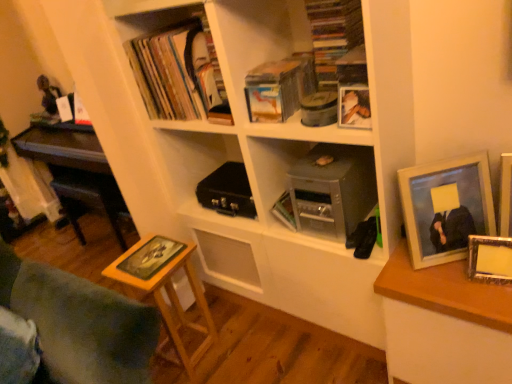
Image resolution: width=512 pixels, height=384 pixels. Describe the element at coordinates (446, 208) in the screenshot. I see `wooden picture frame at right, which is counted as the 3th picture frame, starting from the right` at that location.

What is the approximate height of metallic silver book at center, the second book when ordered from bottom to top?

The height of metallic silver book at center, the second book when ordered from bottom to top, is 5.14 inches.

Describe the element at coordinates (80, 324) in the screenshot. I see `wooden stool at lower left` at that location.

Identify the location of wooden stool at lower left. Image resolution: width=512 pixels, height=384 pixels. (80, 324).

This screenshot has height=384, width=512. Describe the element at coordinates (179, 73) in the screenshot. I see `matte black book at upper left, arranged as the second book when viewed from the left` at that location.

How much space does matte silver picture frame at right, positioned as the 1th picture frame in right-to-left order, occupy vertically?

The height of matte silver picture frame at right, positioned as the 1th picture frame in right-to-left order, is 12.48 inches.

At what (x,y) coordinates should I click in order to perform the action: click on wooden picture frame at right, which is counted as the 3th picture frame, starting from the right. Please return your answer as a coordinate pair (x, y). The height and width of the screenshot is (384, 512). Looking at the image, I should click on (446, 208).

Is black matte briefcase at center next to metallic silver book at center, the second book when ordered from bottom to top, and touching it?

No, black matte briefcase at center is not touching metallic silver book at center, the second book when ordered from bottom to top.

Looking at this image, is black matte briefcase at center oriented away from metallic silver book at center, which appears as the 1th book when viewed from the right?

No, metallic silver book at center, which appears as the 1th book when viewed from the right, is not at the back of black matte briefcase at center.

Which object is wider, black matte briefcase at center or metallic silver book at center, which is the third book from left to right?

black matte briefcase at center is wider.

Based on the photo, from the image's perspective, between black matte briefcase at center and metallic silver book at center, which appears as the 1th book when viewed from the right, who is located below?

metallic silver book at center, which appears as the 1th book when viewed from the right, is shown below in the image.

Is wooden photo frame at right, which ranks as the third picture frame in left-to-right order, directly adjacent to wooden table at lower left?

No, wooden photo frame at right, which ranks as the third picture frame in left-to-right order, is not next to wooden table at lower left.

Could you tell me if wooden photo frame at right, which ranks as the third picture frame in left-to-right order, is turned towards wooden table at lower left?

No, wooden photo frame at right, which ranks as the third picture frame in left-to-right order, does not turn towards wooden table at lower left.

Can you confirm if wooden photo frame at right, positioned as the second picture frame in right-to-left order, is smaller than wooden table at lower left?

Yes, wooden photo frame at right, positioned as the second picture frame in right-to-left order, is smaller than wooden table at lower left.

Measure the distance from metallic silver book at center, which is counted as the second book, starting from the top, to matte silver picture frame at right, the fourth picture frame viewed from the left.

They are 69.86 centimeters apart.

Is the depth of metallic silver book at center, which appears as the 1th book when viewed from the right, greater than that of matte silver picture frame at right, positioned as the 1th picture frame in right-to-left order?

Yes, the depth of metallic silver book at center, which appears as the 1th book when viewed from the right, is greater than that of matte silver picture frame at right, positioned as the 1th picture frame in right-to-left order.

Can you tell me how much metallic silver book at center, which is the third book from left to right, and matte silver picture frame at right, positioned as the 1th picture frame in right-to-left order, differ in facing direction?

15.6 degrees.

Are metallic silver book at center, which is the third book from left to right, and matte silver picture frame at right, the fourth picture frame viewed from the left, far apart?

That's not correct — metallic silver book at center, which is the third book from left to right, is a little close to matte silver picture frame at right, the fourth picture frame viewed from the left.

Is point (338, 118) positioned after point (290, 207)?

No, (338, 118) is closer to viewer.

Is matte silver photo frame at upper right, which is the 4th picture frame from right to left, next to metallic silver book at center, which is counted as the second book, starting from the top?

No, matte silver photo frame at upper right, which is the 4th picture frame from right to left, is not in contact with metallic silver book at center, which is counted as the second book, starting from the top.

From the image's perspective, starting from the metallic silver book at center, which is counted as the second book, starting from the top, which picture frame is the 3rd one above? Please provide its 2D coordinates.

[(354, 107)]

Considering the positions of objects matte silver photo frame at upper right, which is the 4th picture frame from right to left, and metallic silver book at center, which is counted as the second book, starting from the top, in the image provided, who is more to the right, matte silver photo frame at upper right, which is the 4th picture frame from right to left, or metallic silver book at center, which is counted as the second book, starting from the top,?

matte silver photo frame at upper right, which is the 4th picture frame from right to left, is more to the right.

Could wooden photo frame at right, positioned as the second picture frame in right-to-left order, be considered to be inside yellow matte board game at lower left, placed as the first book when sorted from bottom to top?

No.

Does yellow matte board game at lower left, placed as the third book when sorted from right to left, turn towards wooden photo frame at right, which ranks as the third picture frame in left-to-right order?

Yes, yellow matte board game at lower left, placed as the third book when sorted from right to left, is aimed at wooden photo frame at right, which ranks as the third picture frame in left-to-right order.

From the image's perspective, is yellow matte board game at lower left, placed as the first book when sorted from left to right, above wooden photo frame at right, positioned as the second picture frame in right-to-left order?

Incorrect, from the image's perspective, yellow matte board game at lower left, placed as the first book when sorted from left to right, is lower than wooden photo frame at right, positioned as the second picture frame in right-to-left order.

In terms of width, does wooden stool at lower left look wider or thinner when compared to metallic gray briefcase at center?

wooden stool at lower left is wider than metallic gray briefcase at center.

Considering the relative positions of wooden stool at lower left and metallic gray briefcase at center in the image provided, is wooden stool at lower left to the left or to the right of metallic gray briefcase at center?

wooden stool at lower left is positioned on metallic gray briefcase at center's left side.

Which object is closer to the camera, wooden stool at lower left or metallic gray briefcase at center?

wooden stool at lower left is more forward.

This screenshot has width=512, height=384. I want to click on furniture below the metallic gray briefcase at center (from a real-world perspective), so click(80, 324).

From the image's perspective, would you say matte black book at upper left, positioned as the 1th book in top-to-bottom order, is shown under white matte bookcase at center?

Incorrect, from the image's perspective, matte black book at upper left, positioned as the 1th book in top-to-bottom order, is higher than white matte bookcase at center.

From a real-world perspective, relative to white matte bookcase at center, is matte black book at upper left, positioned as the 1th book in top-to-bottom order, vertically above or below?

Clearly, from a real-world perspective, matte black book at upper left, positioned as the 1th book in top-to-bottom order, is above white matte bookcase at center.

Does matte black book at upper left, acting as the 2th book starting from the right, appear on the right side of white matte bookcase at center?

No.

Considering the relative sizes of matte black book at upper left, the third book ordered from the bottom, and white matte bookcase at center in the image provided, is matte black book at upper left, the third book ordered from the bottom, wider than white matte bookcase at center?

Incorrect, the width of matte black book at upper left, the third book ordered from the bottom, does not surpass that of white matte bookcase at center.

What are the coordinates of `stereo above the metallic silver book at center, which is counted as the second book, starting from the top (from a real-world perspective)` in the screenshot? It's located at (227, 191).

At what (x,y) coordinates should I click in order to perform the action: click on table lying on the left of wooden photo frame at right, which ranks as the third picture frame in left-to-right order. Please return your answer as a coordinate pair (x, y). Looking at the image, I should click on (167, 290).

When comparing their distances from matte black book at upper left, the third book ordered from the bottom, does wooden photo frame at right, positioned as the second picture frame in right-to-left order, or matte silver picture frame at right, the fourth picture frame viewed from the left, seem further?

Among the two, matte silver picture frame at right, the fourth picture frame viewed from the left, is located further to matte black book at upper left, the third book ordered from the bottom.

From the image, which object appears to be nearer to black matte briefcase at center, wooden photo frame at right, which ranks as the third picture frame in left-to-right order, or white matte bookcase at center?

The object closer to black matte briefcase at center is white matte bookcase at center.

Which object lies further to the anchor point metallic silver book at center, the second book when ordered from bottom to top, hardcover book at upper center or white matte bookcase at center?

Among the two, white matte bookcase at center is located further to metallic silver book at center, the second book when ordered from bottom to top.

From the image, which object appears to be nearer to metallic silver book at center, the second book when ordered from bottom to top, matte silver picture frame at right, positioned as the 1th picture frame in right-to-left order, or matte black book at upper left, the third book ordered from the bottom?

matte black book at upper left, the third book ordered from the bottom, is positioned closer to the anchor metallic silver book at center, the second book when ordered from bottom to top.

Which object lies nearer to the anchor point metallic gray briefcase at center, wooden picture frame at right, which is counted as the 3th picture frame, starting from the right, or white matte bookcase at center?

The object closer to metallic gray briefcase at center is white matte bookcase at center.

In the scene shown: Looking at the image, which one is located closer to hardcover book at upper center, metallic gray briefcase at center or yellow matte board game at lower left, placed as the first book when sorted from left to right?

Based on the image, metallic gray briefcase at center appears to be nearer to hardcover book at upper center.

Considering their positions, is metallic gray briefcase at center positioned closer to matte silver photo frame at upper right, which is the 4th picture frame from right to left, than hardcover book at upper center?

The object closer to matte silver photo frame at upper right, which is the 4th picture frame from right to left, is hardcover book at upper center.

Based on their spatial positions, is matte silver photo frame at upper right, the first picture frame from the left, or black matte briefcase at center further from wooden picture frame at right, the 2th picture frame positioned from the left?

black matte briefcase at center.

The image size is (512, 384). What are the coordinates of `shelf between matte black book at upper left, acting as the 2th book starting from the right, and matte silver picture frame at right, the fourth picture frame viewed from the left, from left to right` in the screenshot? It's located at (332, 190).

Image resolution: width=512 pixels, height=384 pixels. In order to click on bookcase between wooden stool at lower left and matte silver photo frame at upper right, the first picture frame from the left, from left to right in this screenshot , I will do `click(274, 160)`.

Locate an element on the screen. paperback book that lies between matte black book at upper left, the third book ordered from the bottom, and black matte briefcase at center from top to bottom is located at coordinates (279, 88).

This screenshot has width=512, height=384. In order to click on paperback book located between yellow matte board game at lower left, arranged as the 3th book when viewed from the top, and wooden photo frame at right, which ranks as the third picture frame in left-to-right order, in the left-right direction in this screenshot , I will do `click(279, 88)`.